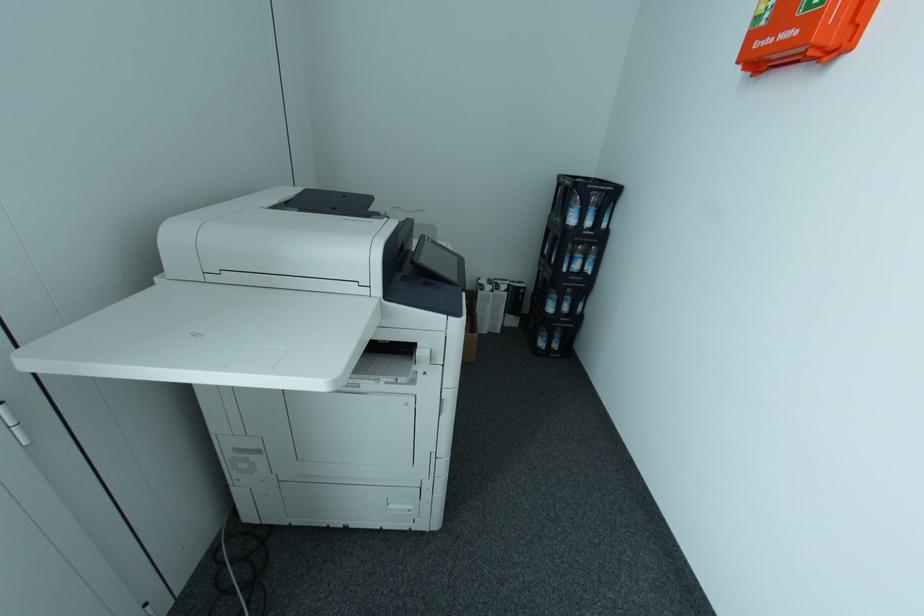
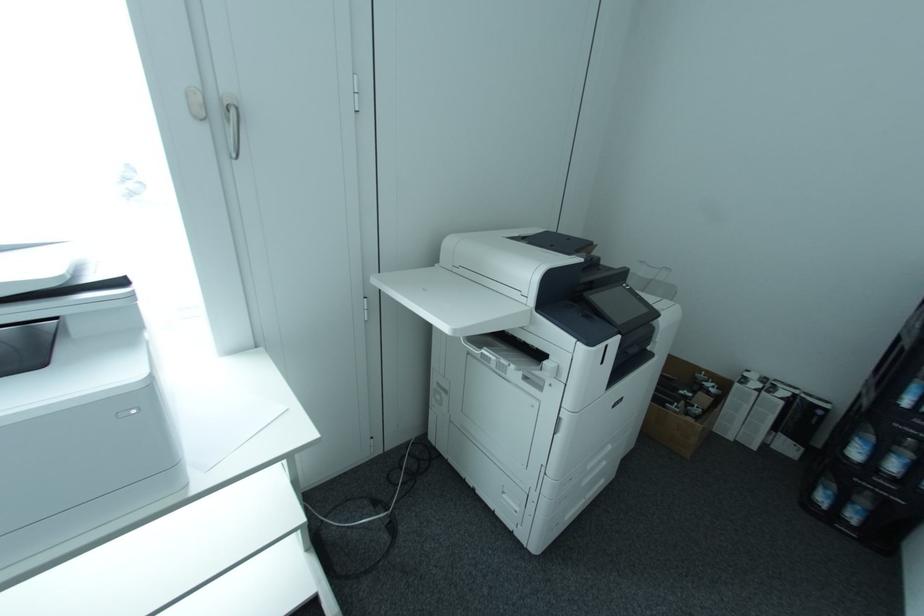
Question: The camera is either moving clockwise (left) or counter-clockwise (right) around the object. The first image is from the beginning of the video and the second image is from the end. Is the camera moving left or right when shooting the video?

Choices:
 (A) Left
 (B) Right

Answer: (B)